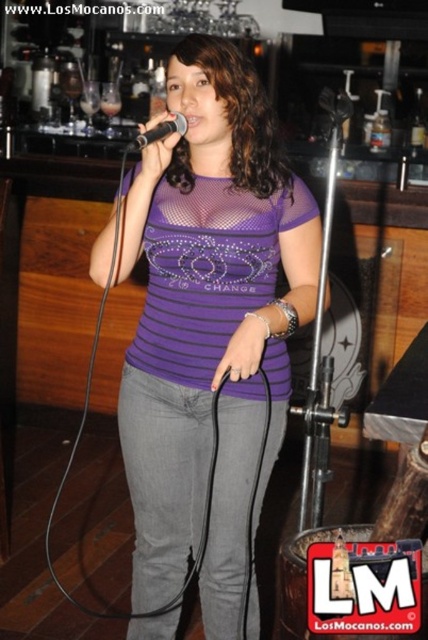
You are a photographer at the event and want to capture a photo where the purple mesh shirt at center and the black matte microphone at center are both clearly visible. Based on their positions, which object should you focus on first to ensure both are in focus?

The purple mesh shirt at center is below the black matte microphone at center. To ensure both are in focus, you should focus on the black matte microphone at center first since it is closer to the camera, and the shirt will naturally fall into the depth of field if focused on the microphone.

You are a photographer setting up for a live performance. You need to ensure the purple mesh shirt at center and the black matte microphone at center are both visible in the photo. Given their sizes, which object should you focus on to ensure both are in frame?

The purple mesh shirt at center is larger than the black matte microphone at center, so focusing on the purple mesh shirt at center will ensure both objects are in frame since it takes up more space.

You are a photographer setting up for a live performance. You need to ensure that the purple mesh shirt at center and the black matte microphone at center are both visible in your shot. Given that the purple mesh shirt is wider than the microphone, what should you adjust to frame both properly?

Since the purple mesh shirt at center is wider than the black matte microphone at center, you should widen your camera frame to accommodate the shirt while still including the microphone.